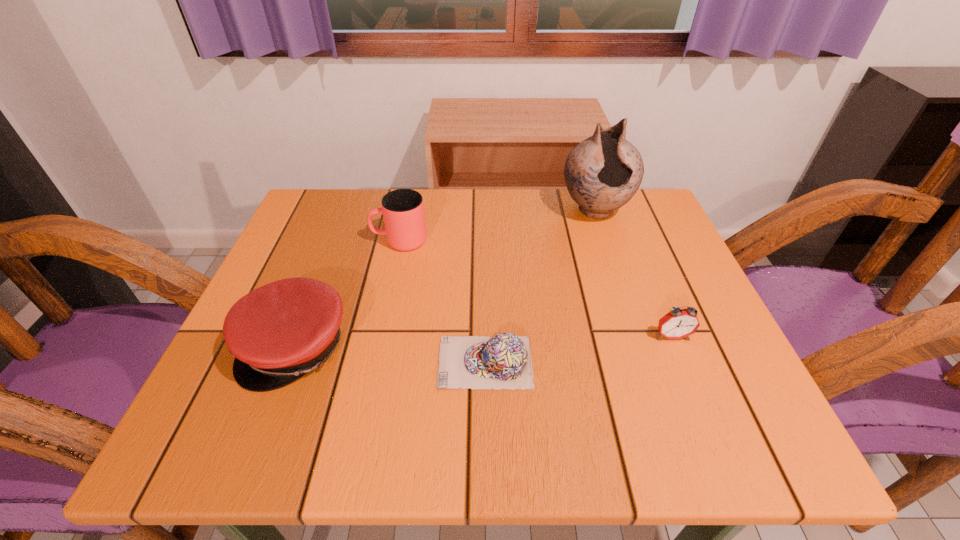
At what (x,y) coordinates should I click in order to perform the action: click on the tallest object. Please return your answer as a coordinate pair (x, y). Looking at the image, I should click on (602, 173).

Identify the location of cup. The height and width of the screenshot is (540, 960). (403, 209).

Where is `the taller cap`? the taller cap is located at coordinates (277, 333).

Locate an element on the screen. The height and width of the screenshot is (540, 960). alarm clock is located at coordinates (679, 323).

Locate an element on the screen. the right cap is located at coordinates (503, 361).

Where is `the third object from right to left`? the third object from right to left is located at coordinates (503, 361).

At what (x,y) coordinates should I click in order to perform the action: click on vacant space located from the spout of the tallest object. Please return your answer as a coordinate pair (x, y). Image resolution: width=960 pixels, height=540 pixels. Looking at the image, I should click on point(618,281).

Where is `vacant space located 0.180m on the handle side of the second tallest object`? Image resolution: width=960 pixels, height=540 pixels. vacant space located 0.180m on the handle side of the second tallest object is located at coordinates (295, 241).

Identify the location of vacant space located 0.090m at the front of the left cap where the visor is located. This screenshot has height=540, width=960. (259, 445).

Identify the location of free location located 0.210m on the clock face of the alarm clock. The height and width of the screenshot is (540, 960). (720, 454).